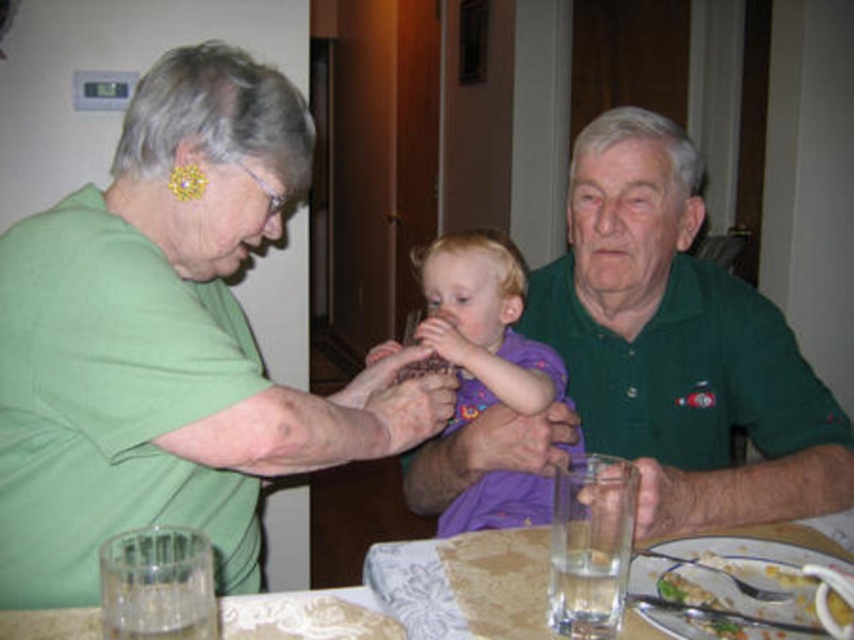
Question: Is green matte shirt at upper left wider than purple soft fabric baby at center?

Choices:
 (A) no
 (B) yes

Answer: (B)

Question: Can you confirm if yellowish plastic plate at lower right is positioned to the right of clear glass water at lower center?

Choices:
 (A) yes
 (B) no

Answer: (A)

Question: Which point is farther to the camera?

Choices:
 (A) (459, 342)
 (B) (430, 548)
 (C) (812, 596)
 (D) (585, 257)

Answer: (D)

Question: Considering the relative positions of purple soft fabric baby at center and clear glass water at lower center in the image provided, where is purple soft fabric baby at center located with respect to clear glass water at lower center?

Choices:
 (A) right
 (B) left

Answer: (A)

Question: Which object appears closest to the camera in this image?

Choices:
 (A) green cotton shirt at center
 (B) purple soft fabric baby at center

Answer: (A)

Question: Which of the following is the closest to the observer?

Choices:
 (A) green matte shirt at upper left
 (B) clear glass water at lower center
 (C) yellowish plastic plate at lower right

Answer: (B)